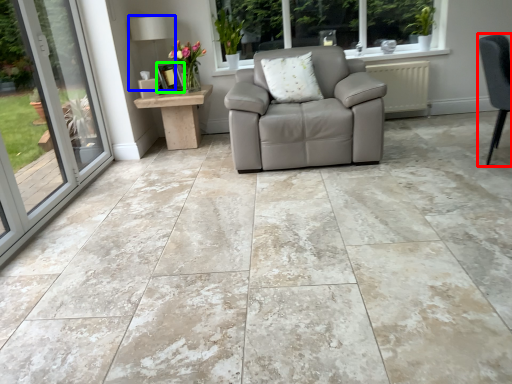
Question: Considering the real-world distances, which object is farthest from chair (highlighted by a red box)? lamp (highlighted by a blue box) or picture frame (highlighted by a green box)?

Choices:
 (A) lamp
 (B) picture frame

Answer: (A)